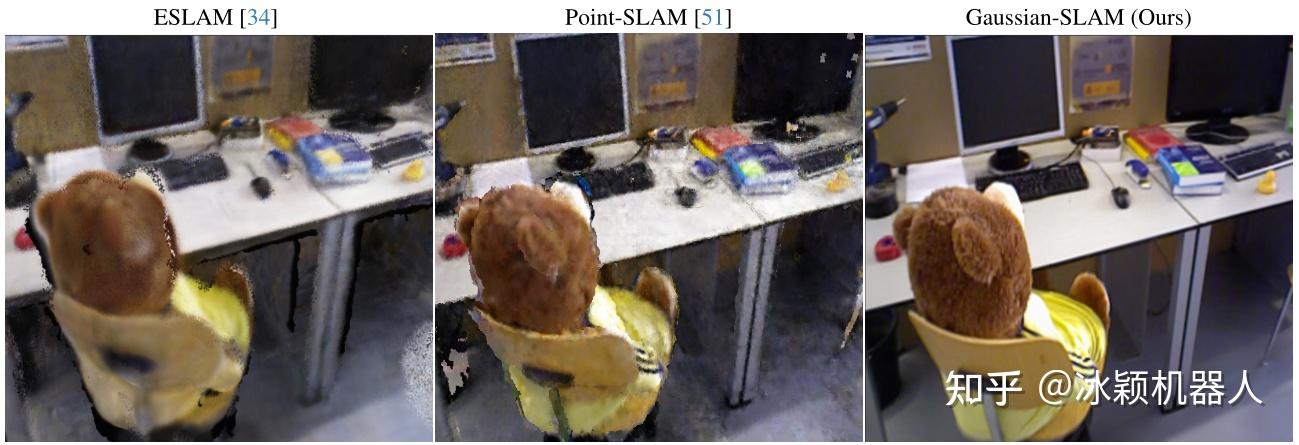
Image resolution: width=1299 pixels, height=445 pixels. I want to click on chair, so click(1018, 379).